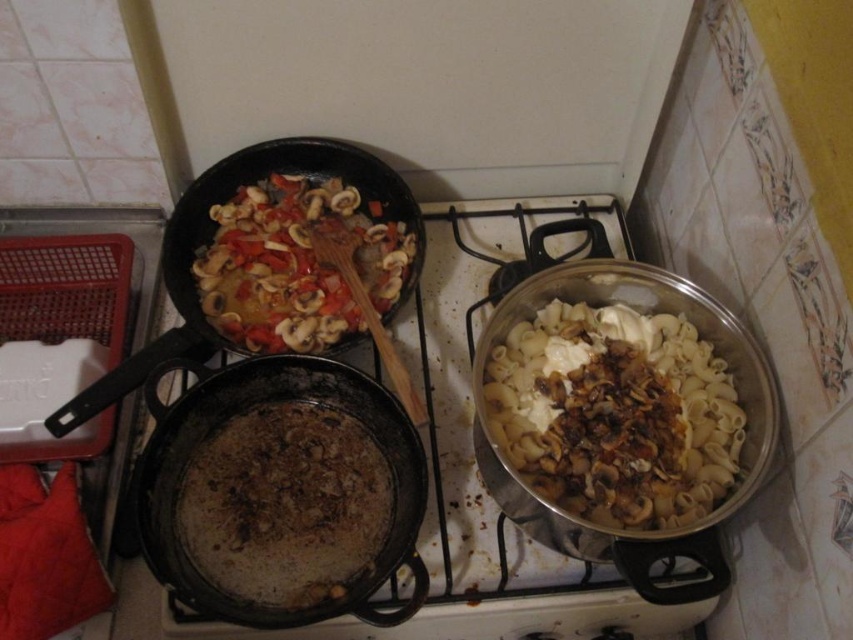
Between white glossy pasta at center right and shiny black wok at upper left, which one appears on the right side from the viewer's perspective?

white glossy pasta at center right is more to the right.

The image size is (853, 640). I want to click on white glossy pasta at center right, so click(x=614, y=413).

Locate an element on the screen. white glossy pasta at center right is located at coordinates (614, 413).

Does black cast iron wok at center have a greater height compared to white glossy pasta at center right?

Yes, black cast iron wok at center is taller than white glossy pasta at center right.

Measure the distance between point (x=409, y=468) and camera.

32.74 inches

This screenshot has width=853, height=640. In order to click on black cast iron wok at center in this screenshot , I will do `click(277, 490)`.

Can you confirm if slightly browned wooden spoon at upper left is smaller than shiny black wok at upper left?

Indeed, slightly browned wooden spoon at upper left has a smaller size compared to shiny black wok at upper left.

Is point (395, 256) closer to viewer compared to point (149, 352)?

No, it is behind (149, 352).

Is point (318, 259) behind point (149, 369)?

Yes, point (318, 259) is farther from viewer.

You are a GUI agent. You are given a task and a screenshot of the screen. Output one action in this format:
    pyautogui.click(x=<x>, y=<y>)
    Task: Click on the slightly browned wooden spoon at upper left
    
    Given the screenshot: What is the action you would take?
    pyautogui.click(x=297, y=264)